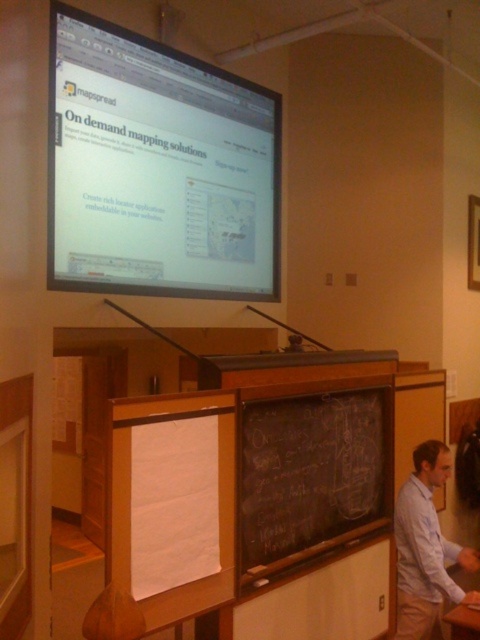
Question: Where is matte black screen at upper center located in relation to light blue shirt at lower right in the image?

Choices:
 (A) right
 (B) left

Answer: (B)

Question: Among these points, which one is nearest to the camera?

Choices:
 (A) (127, 228)
 (B) (260, 486)

Answer: (B)

Question: Among these objects, which one is nearest to the camera?

Choices:
 (A) matte black screen at upper center
 (B) black chalkboard at center
 (C) wooden table at lower right
 (D) light blue shirt at lower right

Answer: (C)

Question: Which point is closer to the camera taking this photo?

Choices:
 (A) (245, 461)
 (B) (469, 620)
 (C) (434, 524)

Answer: (B)

Question: Is matte black screen at upper center to the right of black chalkboard at center from the viewer's perspective?

Choices:
 (A) no
 (B) yes

Answer: (A)

Question: Does matte black screen at upper center appear on the left side of black chalkboard at center?

Choices:
 (A) no
 (B) yes

Answer: (B)